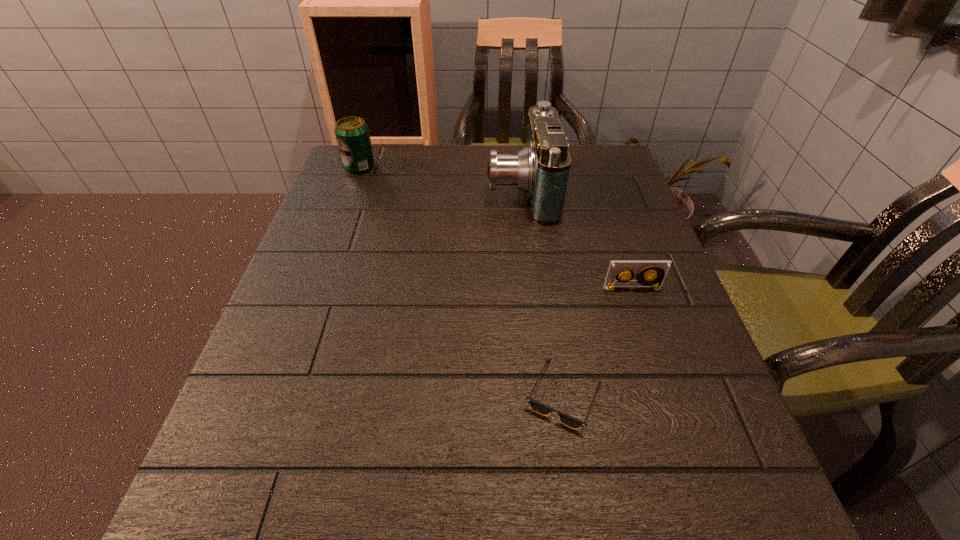
You are a GUI agent. You are given a task and a screenshot of the screen. Output one action in this format:
    pyautogui.click(x=<x>, y=<y>)
    Task: Click on the free space between the camcorder and the shortest object
    Image resolution: width=960 pixels, height=540 pixels.
    Given the screenshot: What is the action you would take?
    pyautogui.click(x=542, y=292)

Locate an element on the screen. Image resolution: width=960 pixels, height=540 pixels. free spot between the third farthest object and the camcorder is located at coordinates (577, 239).

Identify the location of vacant area between the third shortest object and the shortest object. The image size is (960, 540). (462, 281).

Where is `free space that is in between the sunglasses and the camcorder`? This screenshot has height=540, width=960. free space that is in between the sunglasses and the camcorder is located at coordinates (542, 292).

At what (x,y) coordinates should I click in order to perform the action: click on blank region between the beer can and the shortest object. Please return your answer as a coordinate pair (x, y). Looking at the image, I should click on (462, 281).

You are a GUI agent. You are given a task and a screenshot of the screen. Output one action in this format:
    pyautogui.click(x=<x>, y=<y>)
    Task: Click on the object that stands as the third closest to the videotape
    This screenshot has width=960, height=540.
    Given the screenshot: What is the action you would take?
    pyautogui.click(x=352, y=134)

Where is `object that is the closest to the rightmost object`? The image size is (960, 540). object that is the closest to the rightmost object is located at coordinates (572, 422).